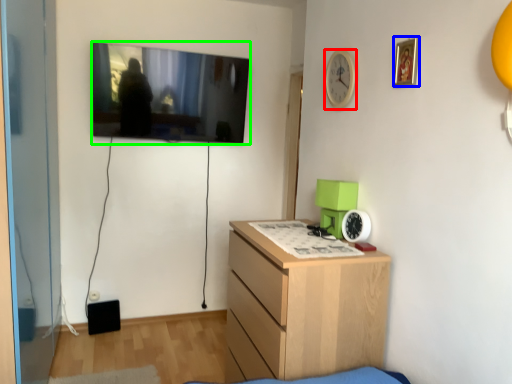
Question: Which is nearer to the clock (highlighted by a red box)? picture frame (highlighted by a blue box) or television (highlighted by a green box).

Choices:
 (A) picture frame
 (B) television

Answer: (A)